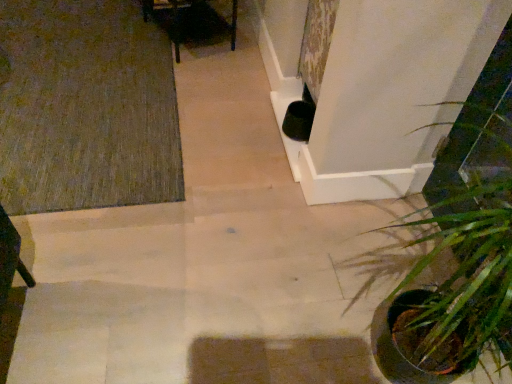
Question: From their relative heights in the image, would you say green textured rug at upper left is taller or shorter than green leafy plant at lower right?

Choices:
 (A) tall
 (B) short

Answer: (B)

Question: Considering the positions of point (165, 163) and point (445, 284), is point (165, 163) closer or farther from the camera than point (445, 284)?

Choices:
 (A) farther
 (B) closer

Answer: (A)

Question: In terms of width, does green textured rug at upper left look wider or thinner when compared to green leafy plant at lower right?

Choices:
 (A) thin
 (B) wide

Answer: (B)

Question: Is green leafy plant at lower right taller or shorter than green textured rug at upper left?

Choices:
 (A) short
 (B) tall

Answer: (B)

Question: Do you think green leafy plant at lower right is within green textured rug at upper left, or outside of it?

Choices:
 (A) inside
 (B) outside

Answer: (B)

Question: Considering the positions of green leafy plant at lower right and green textured rug at upper left in the image, is green leafy plant at lower right bigger or smaller than green textured rug at upper left?

Choices:
 (A) big
 (B) small

Answer: (A)

Question: In terms of width, does green leafy plant at lower right look wider or thinner when compared to green textured rug at upper left?

Choices:
 (A) thin
 (B) wide

Answer: (A)